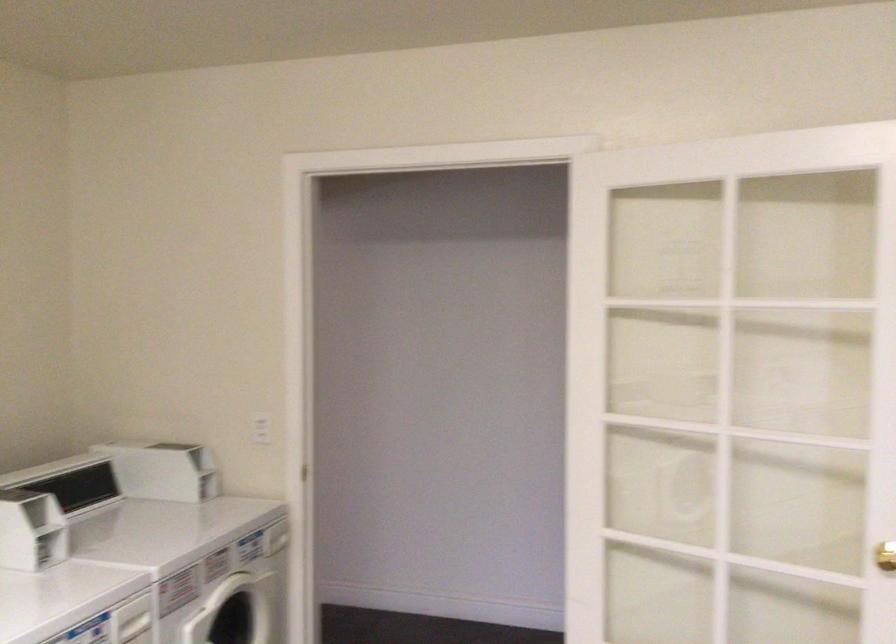
What do you see at coordinates (70, 482) in the screenshot? I see `a washing machine lid` at bounding box center [70, 482].